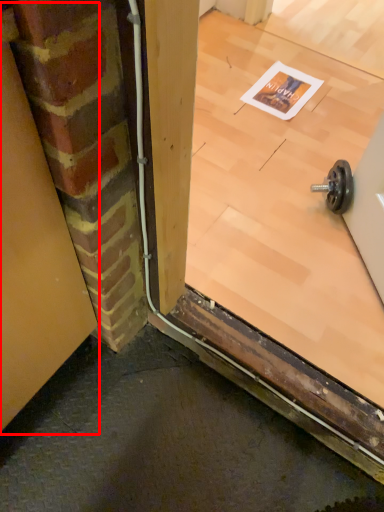
Question: In this image, where is garage door (annotated by the red box) located relative to window?

Choices:
 (A) left
 (B) right

Answer: (A)